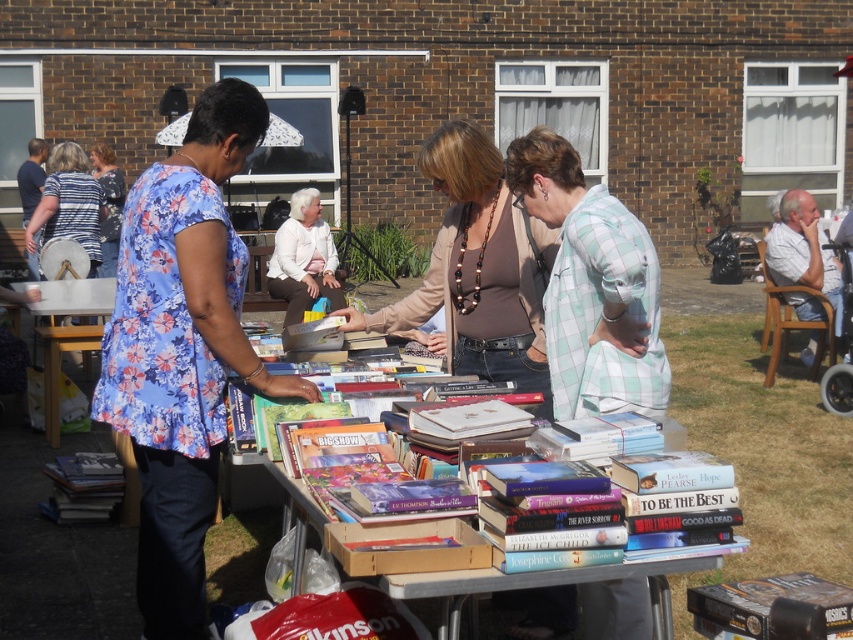
Can you confirm if brown leather jacket at center is taller than white cotton shirt at right?

No.

Which of these two, brown leather jacket at center or white cotton shirt at right, stands taller?

Standing taller between the two is white cotton shirt at right.

What do you see at coordinates (479, 268) in the screenshot?
I see `brown leather jacket at center` at bounding box center [479, 268].

At what (x,y) coordinates should I click in order to perform the action: click on brown leather jacket at center. Please return your answer as a coordinate pair (x, y). Looking at the image, I should click on (479, 268).

Can you confirm if floral fabric blouse at left is shorter than green plaid shirt at center?

In fact, floral fabric blouse at left may be taller than green plaid shirt at center.

Based on the photo, which is more to the right, floral fabric blouse at left or green plaid shirt at center?

Positioned to the right is green plaid shirt at center.

Is point (225, 348) closer to camera compared to point (576, 225)?

Yes, point (225, 348) is in front of point (576, 225).

Identify the location of floral fabric blouse at left. Image resolution: width=853 pixels, height=640 pixels. (183, 349).

Does point (459, 140) lie in front of point (91, 476)?

Yes.

Is brown leather jacket at center to the right of hardcover book at lower left from the viewer's perspective?

Yes, brown leather jacket at center is to the right of hardcover book at lower left.

Locate an element on the screen. brown leather jacket at center is located at coordinates (479, 268).